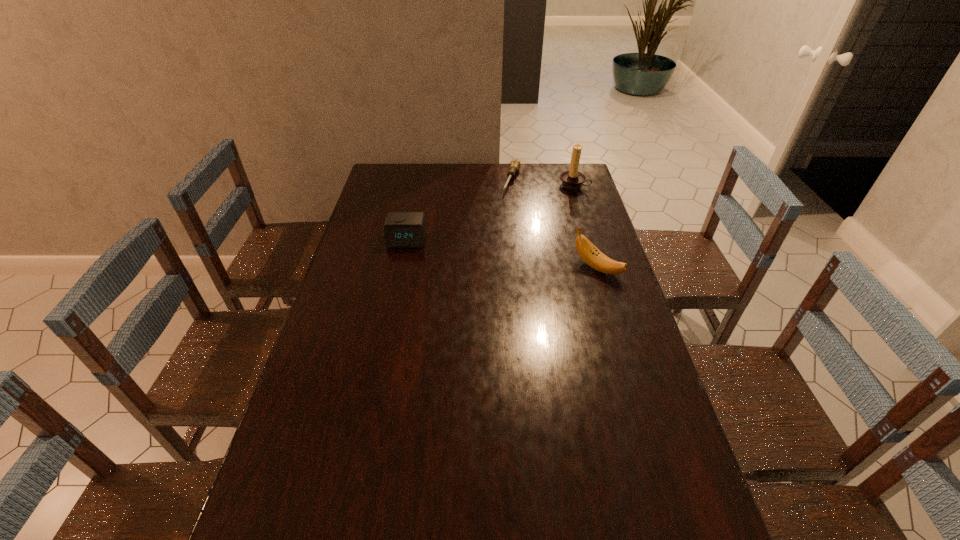
You are a GUI agent. You are given a task and a screenshot of the screen. Output one action in this format:
    pyautogui.click(x=<x>, y=<y>)
    Task: Click on the third farthest object
    Image resolution: width=960 pixels, height=540 pixels.
    Given the screenshot: What is the action you would take?
    pyautogui.click(x=402, y=229)

Locate an element on the screen. the second shortest object is located at coordinates (402, 229).

Find the location of a particular element. the nearest object is located at coordinates (591, 255).

Find the location of a particular element. This screenshot has height=540, width=960. banana is located at coordinates (591, 255).

At what (x,y) coordinates should I click in order to perform the action: click on screwdriver. Please return your answer as a coordinate pair (x, y). Looking at the image, I should click on (514, 165).

At what (x,y) coordinates should I click in order to perform the action: click on the third object from right to left. Please return your answer as a coordinate pair (x, y). This screenshot has width=960, height=540. Looking at the image, I should click on (514, 165).

The height and width of the screenshot is (540, 960). Find the location of `the tallest object`. the tallest object is located at coordinates (573, 179).

This screenshot has height=540, width=960. Identify the location of vacant space situated on the front-facing side of the leftmost object. (394, 301).

Where is `free location located on the left of the banana`? free location located on the left of the banana is located at coordinates (489, 268).

The image size is (960, 540). What are the coordinates of `vacant space located 0.200m at the tip of the second object from left to right` in the screenshot? It's located at (498, 221).